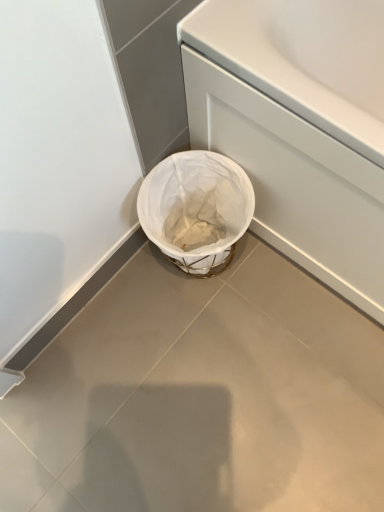
Question: Could white matte bath at lower right be considered to be inside white fabric basket at lower center?

Choices:
 (A) yes
 (B) no

Answer: (B)

Question: Is the position of white fabric basket at lower center less distant than that of white matte bath at lower right?

Choices:
 (A) no
 (B) yes

Answer: (A)

Question: Can you confirm if white fabric basket at lower center is thinner than white matte bath at lower right?

Choices:
 (A) no
 (B) yes

Answer: (B)

Question: Is white fabric basket at lower center not close to white matte bath at lower right?

Choices:
 (A) yes
 (B) no

Answer: (B)

Question: Is white fabric basket at lower center beside white matte bath at lower right?

Choices:
 (A) yes
 (B) no

Answer: (B)

Question: Can you confirm if white fabric basket at lower center is positioned to the right of white matte bath at lower right?

Choices:
 (A) no
 (B) yes

Answer: (A)

Question: Is white matte bath at lower right at the left side of white fabric basket at lower center?

Choices:
 (A) yes
 (B) no

Answer: (B)

Question: Is there a large distance between white matte bath at lower right and white fabric basket at lower center?

Choices:
 (A) no
 (B) yes

Answer: (A)

Question: Is white matte bath at lower right looking in the opposite direction of white fabric basket at lower center?

Choices:
 (A) no
 (B) yes

Answer: (A)

Question: Can you confirm if white matte bath at lower right is wider than white fabric basket at lower center?

Choices:
 (A) yes
 (B) no

Answer: (A)

Question: Is white fabric basket at lower center a part of white matte bath at lower right?

Choices:
 (A) yes
 (B) no

Answer: (B)

Question: Can you confirm if white matte bath at lower right is thinner than white fabric basket at lower center?

Choices:
 (A) yes
 (B) no

Answer: (B)

Question: Is white fabric basket at lower center directly adjacent to white matte bath at lower right?

Choices:
 (A) yes
 (B) no

Answer: (B)